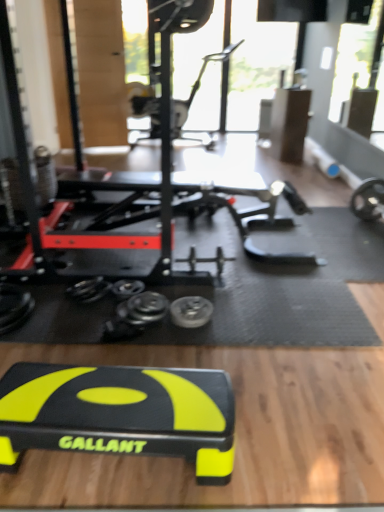
Question: In terms of width, does metallic silver weight at center look wider or thinner when compared to metallic silver exercise bike at upper center, marked as the 1th sport equipment in a top-to-bottom arrangement?

Choices:
 (A) wide
 (B) thin

Answer: (B)

Question: Is metallic silver weight at center inside the boundaries of metallic silver exercise bike at upper center, which is the 2th sport equipment in bottom-to-top order, or outside?

Choices:
 (A) inside
 (B) outside

Answer: (B)

Question: Based on their relative distances, which object is farther from the metallic silver exercise bike at upper center, the 1th sport equipment positioned from the back?

Choices:
 (A) metallic silver weight at center
 (B) black rubber step platform at center, which is the second sport equipment in back-to-front order

Answer: (B)

Question: Estimate the real-world distances between objects in this image. Which object is farther from the metallic silver weight at center?

Choices:
 (A) black rubber step platform at center, arranged as the first sport equipment when viewed from the front
 (B) metallic silver exercise bike at upper center, which is counted as the 2th sport equipment, starting from the front

Answer: (B)